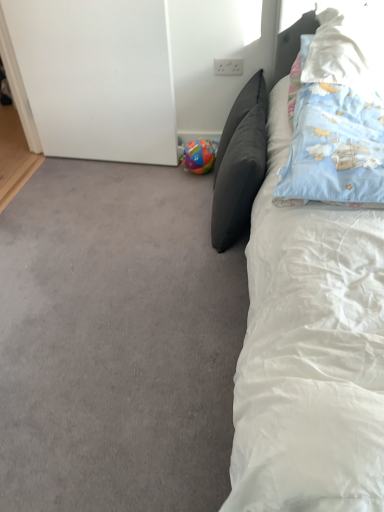
This screenshot has height=512, width=384. Identify the location of free space between multicolored plastic ball at lower left and dark gray cushion at center, which is counted as the first pillow, starting from the left. (190, 199).